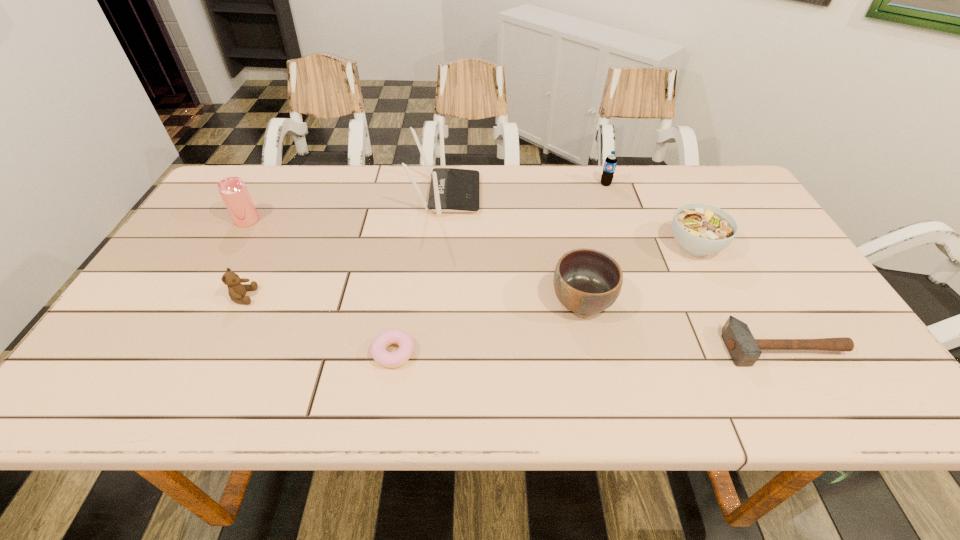
This screenshot has width=960, height=540. What are the coordinates of `empty space that is in between the hammer and the teddy bear` in the screenshot? It's located at (513, 322).

The image size is (960, 540). What are the coordinates of `vacant area that lies between the soup bowl and the leftmost object` in the screenshot? It's located at (471, 233).

You are a GUI agent. You are given a task and a screenshot of the screen. Output one action in this format:
    pyautogui.click(x=<x>, y=<y>)
    Task: Click on the free space between the doughnut and the seventh tallest object
    The width and height of the screenshot is (960, 540).
    Given the screenshot: What is the action you would take?
    (x=588, y=350)

The width and height of the screenshot is (960, 540). In order to click on free space that is in between the leftmost object and the doughnut in this screenshot , I will do `click(321, 287)`.

The height and width of the screenshot is (540, 960). I want to click on empty location between the bowl and the sixth object from left to right, so click(x=594, y=242).

The height and width of the screenshot is (540, 960). Find the location of `empty location between the bowl and the soup bowl`. empty location between the bowl and the soup bowl is located at coordinates (638, 273).

You are a GUI agent. You are given a task and a screenshot of the screen. Output one action in this format:
    pyautogui.click(x=<x>, y=<y>)
    Task: Click on the unoccupied position between the soda bottle and the beer can
    The width and height of the screenshot is (960, 540).
    Given the screenshot: What is the action you would take?
    pyautogui.click(x=426, y=202)

Find the location of a particular element. Image resolution: width=960 pixels, height=540 pixels. blank region between the doughnut and the router is located at coordinates (420, 274).

This screenshot has height=540, width=960. In order to click on object that is the seventh closest to the bowl in this screenshot , I will do `click(233, 190)`.

Select which object is the fifth closest to the soda bottle. Please provide its 2D coordinates. Your answer should be formatted as a tuple, i.e. [(x, y)], where the tuple contains the x and y coordinates of a point satisfying the conditions above.

[(379, 353)]